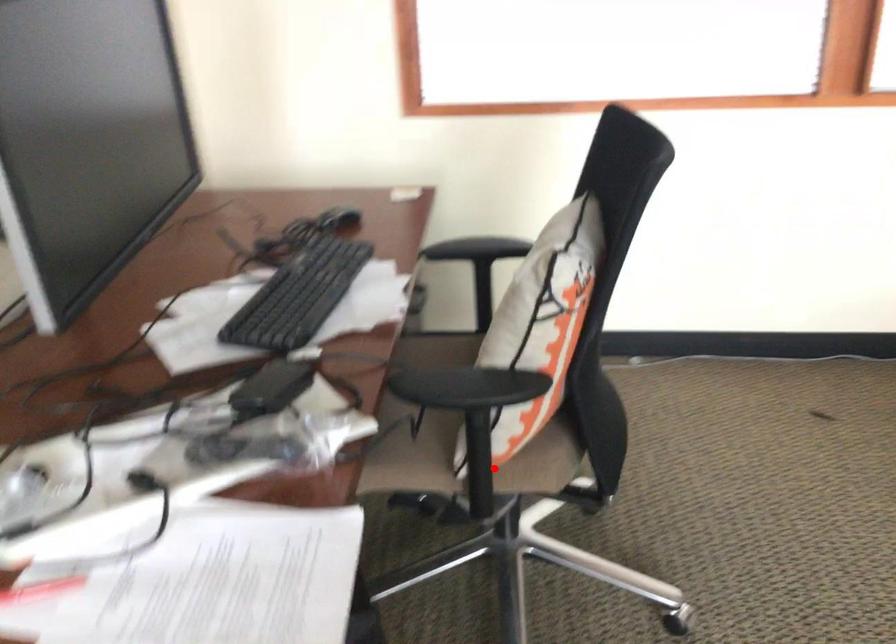
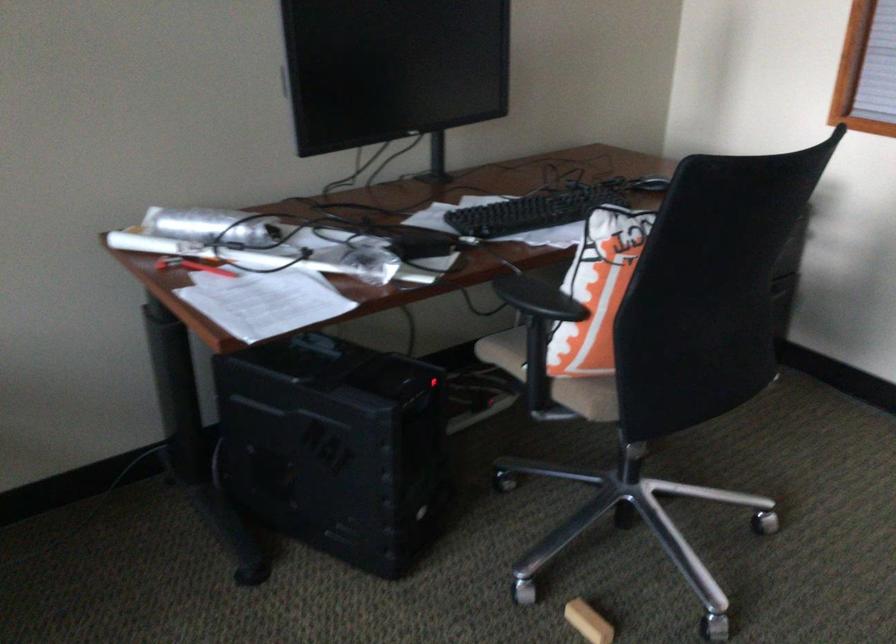
Find the pixel in the second image that matches the highlighted location in the first image.

(552, 377)